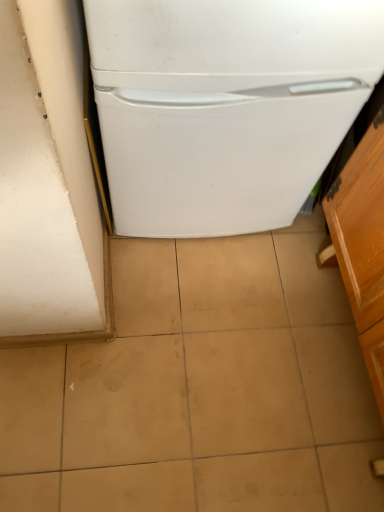
Question: Does white matte refrigerator at center have a greater width compared to wooden cabinet at right?

Choices:
 (A) yes
 (B) no

Answer: (A)

Question: Considering the relative sizes of white matte refrigerator at center and wooden cabinet at right in the image provided, is white matte refrigerator at center smaller than wooden cabinet at right?

Choices:
 (A) yes
 (B) no

Answer: (B)

Question: Is white matte refrigerator at center positioned with its back to wooden cabinet at right?

Choices:
 (A) yes
 (B) no

Answer: (B)

Question: Could you tell me if white matte refrigerator at center is facing wooden cabinet at right?

Choices:
 (A) yes
 (B) no

Answer: (B)

Question: Does white matte refrigerator at center have a larger size compared to wooden cabinet at right?

Choices:
 (A) yes
 (B) no

Answer: (A)

Question: Is white matte refrigerator at center shorter than wooden cabinet at right?

Choices:
 (A) yes
 (B) no

Answer: (B)

Question: Is wooden cabinet at right positioned with its back to white matte refrigerator at center?

Choices:
 (A) yes
 (B) no

Answer: (B)

Question: Can we say wooden cabinet at right lies outside white matte refrigerator at center?

Choices:
 (A) no
 (B) yes

Answer: (B)

Question: Is the depth of wooden cabinet at right less than that of white matte refrigerator at center?

Choices:
 (A) no
 (B) yes

Answer: (B)

Question: From the image's perspective, is wooden cabinet at right beneath white matte refrigerator at center?

Choices:
 (A) yes
 (B) no

Answer: (A)

Question: Are wooden cabinet at right and white matte refrigerator at center making contact?

Choices:
 (A) no
 (B) yes

Answer: (A)

Question: From a real-world perspective, is wooden cabinet at right on white matte refrigerator at center?

Choices:
 (A) yes
 (B) no

Answer: (B)

Question: From the image's perspective, is white matte refrigerator at center located above or below wooden cabinet at right?

Choices:
 (A) below
 (B) above

Answer: (B)